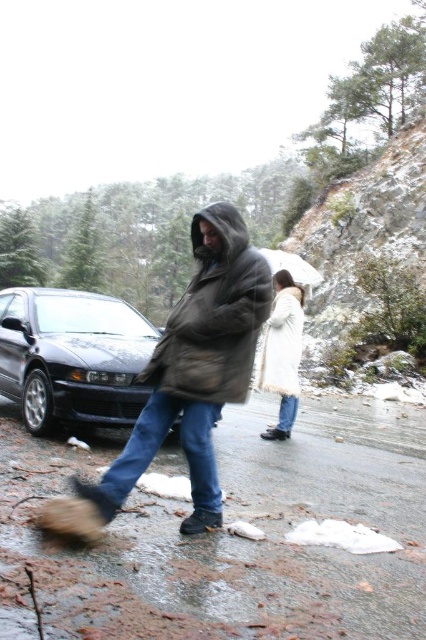
You are a delivery person trying to reach the person in the brown fuzzy coat at center. The maximum distance you can walk is 3 meters. Can you reach them?

They are 3.02 meters apart. Since your maximum walking distance is 3 meters, you cannot reach the person in the brown fuzzy coat at center.

You are a delivery person who needs to place a package on the shiny black car at center. However, there is a person wearing a white fur coat at center in the way. Based on the scene, can you determine if the car is accessible for placing the package?

The shiny black car at center is located above the white fur coat at center, meaning the person is standing below the car. Therefore, the car is accessible for placing the package as the person is not blocking the car itself.

You are a delivery person trying to reach the shiny black car at center. There is a brown fuzzy coat at center blocking your path. Can you walk around it without stepping on the icy road?

The brown fuzzy coat at center is shorter than the shiny black car at center, so you can walk around it by going around the sides since the coat is shorter and likely lower to the ground than the car.